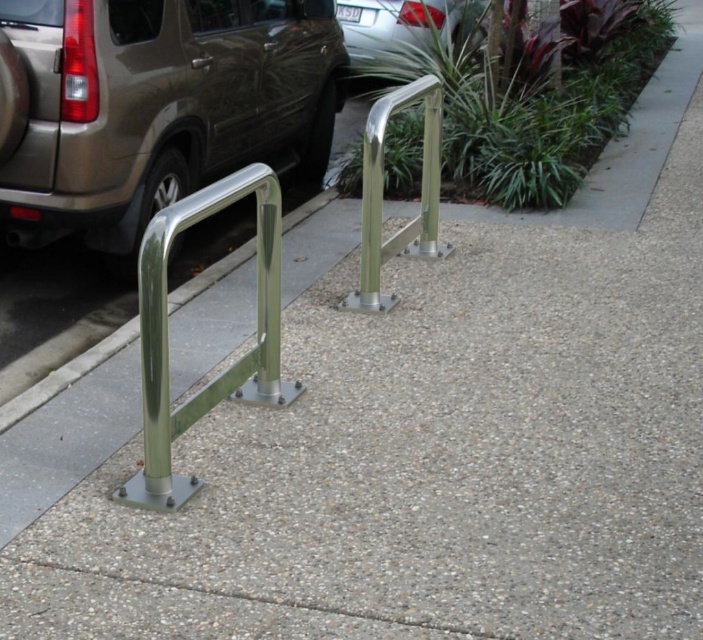
You are standing at the origin point in the image. A satin silver minivan at left is represented by point (154, 106). Where is the satin silver minivan at left located relative to the origin?

The satin silver minivan at left is located at coordinates point (154, 106) relative to the origin.

You are standing at the parked car and looking towards the sidewalk. Which of the two points, point (39,170) or point (370,22), is closer to you?

Point (370,22) is closer to you because it is behind point (39,170), meaning the latter is farther away.